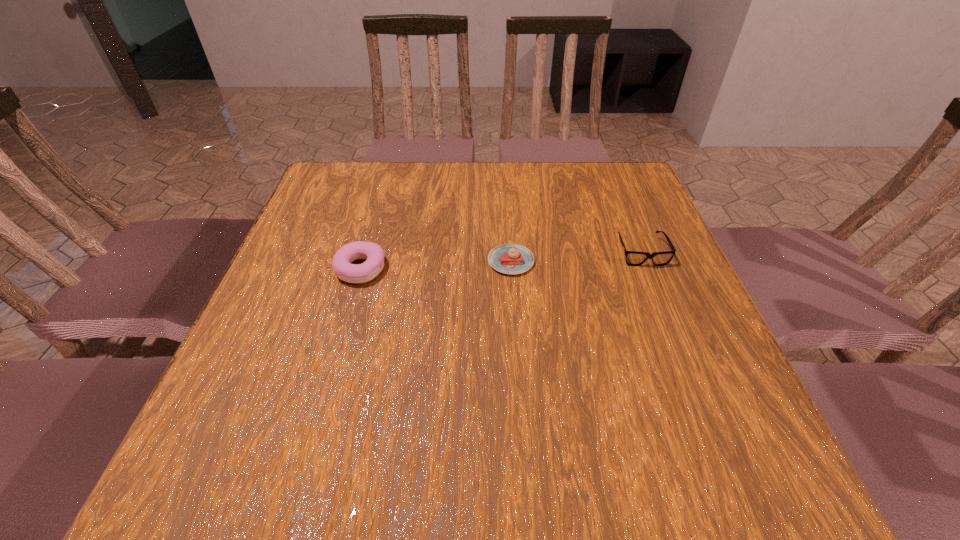
Where is `vacant area at the far edge of the desktop`? vacant area at the far edge of the desktop is located at coordinates (476, 199).

I want to click on vacant space at the near edge of the desktop, so click(x=492, y=472).

I want to click on free region at the left edge of the desktop, so click(x=298, y=358).

Locate an element on the screen. This screenshot has width=960, height=540. free space at the right edge is located at coordinates (675, 286).

This screenshot has width=960, height=540. In the image, there is a desktop. Identify the location of vacant space at the near left corner. (236, 460).

In the image, there is a desktop. Identify the location of vacant space at the far right corner. (638, 200).

Locate an element on the screen. free spot between the taller pastry and the shortest object is located at coordinates (436, 265).

The image size is (960, 540). I want to click on vacant point located between the shortest object and the rightmost object, so click(x=576, y=256).

Find the location of a particular element. This screenshot has width=960, height=540. unoccupied position between the rightmost object and the shorter pastry is located at coordinates (576, 256).

Identify the location of unoccupied area between the second object from left to right and the rightmost object. Image resolution: width=960 pixels, height=540 pixels. (576, 256).